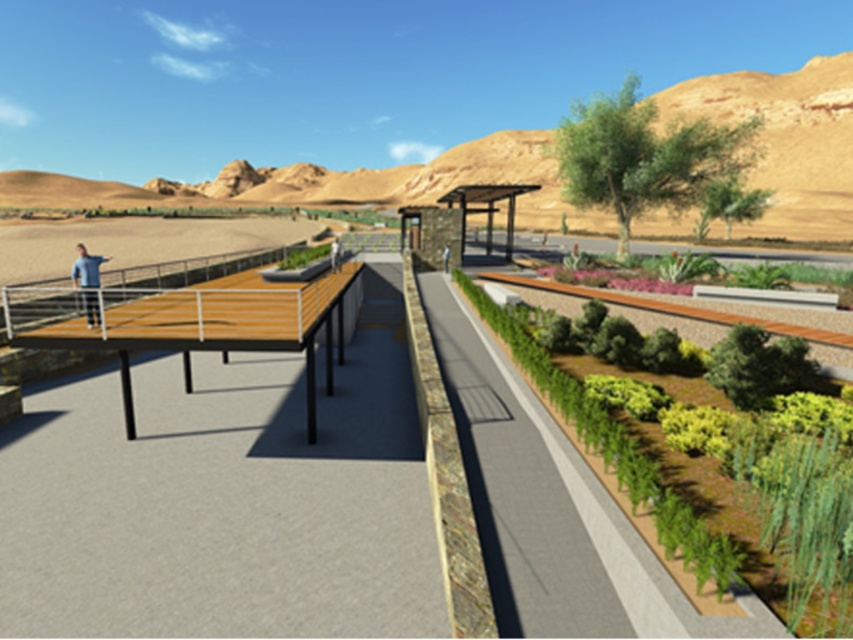
You are a landscape architect designing a new desert garden. You need to place a decorative statue that is 1.2 meters wide. The statue must be placed on either the wooden deck at left or the blue fabric shirt at left. Which location can accommodate the statue based on their widths?

The wooden deck at left has a larger width than the blue fabric shirt at left, so the statue can be placed on the wooden deck at left.

You are planning a picnic in the desert landscape and want to set up a blanket between the wooden picnic table at left and the green leafy shrubs at center right. If your blanket is 6 meters long, will it fit between them without overlapping either object?

The distance between the wooden picnic table at left and the green leafy shrubs at center right is 5.85 meters. Since the blanket is 6 meters long, it will be slightly too long and will overlap both objects.

In the scene shown: You are planning to set up a picnic and need to know if the wooden picnic table at left is positioned higher than the green leafy shrubs at center right. Based on the scene, can you confirm this?

The wooden picnic table at left is located above green leafy shrubs at center right, so yes, it is positioned higher.